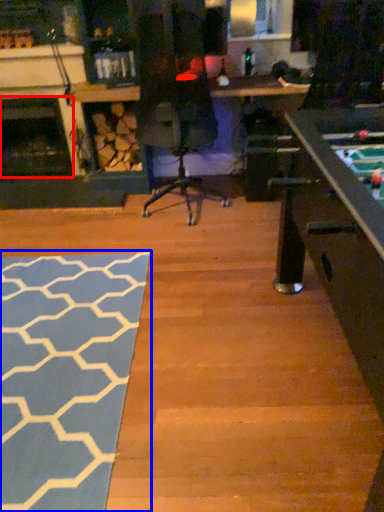
Question: Which object appears farthest to the camera in this image, fireplace (highlighted by a red box) or mat (highlighted by a blue box)?

Choices:
 (A) fireplace
 (B) mat

Answer: (A)